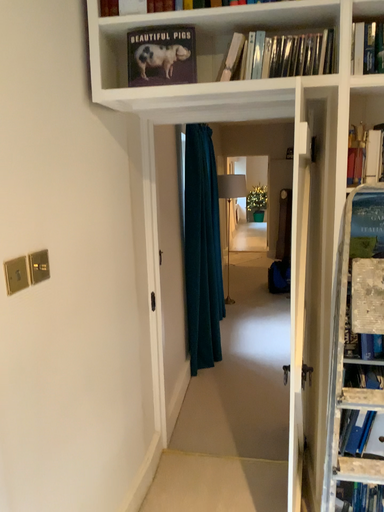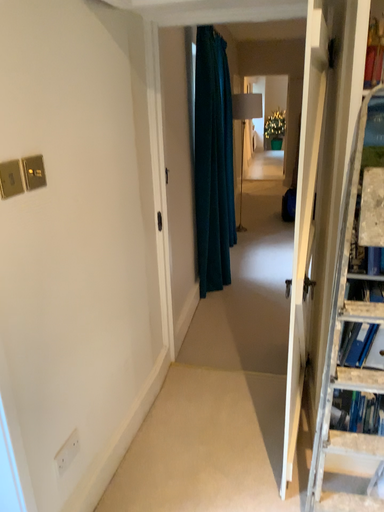
Question: How did the camera likely rotate when shooting the video?

Choices:
 (A) rotated upward
 (B) rotated downward

Answer: (B)